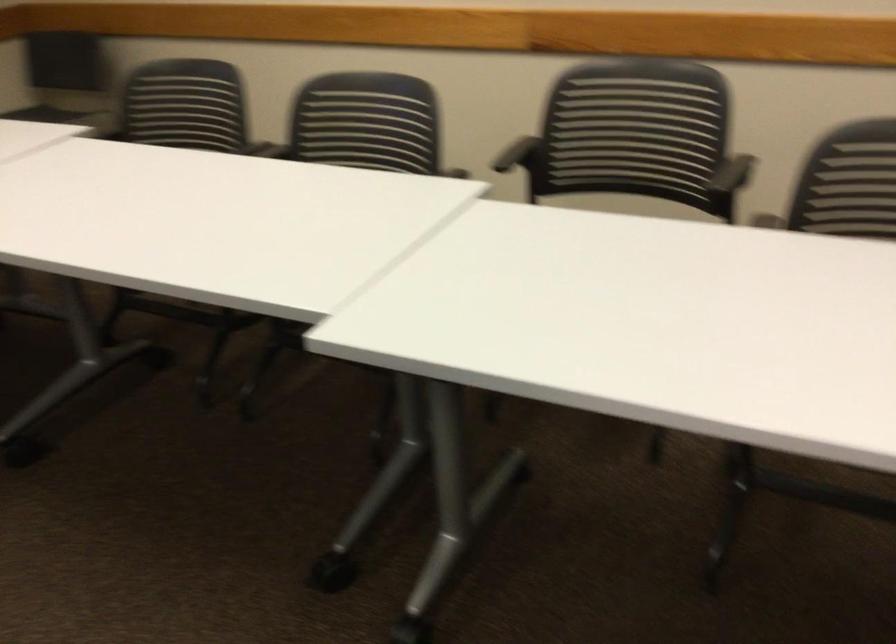
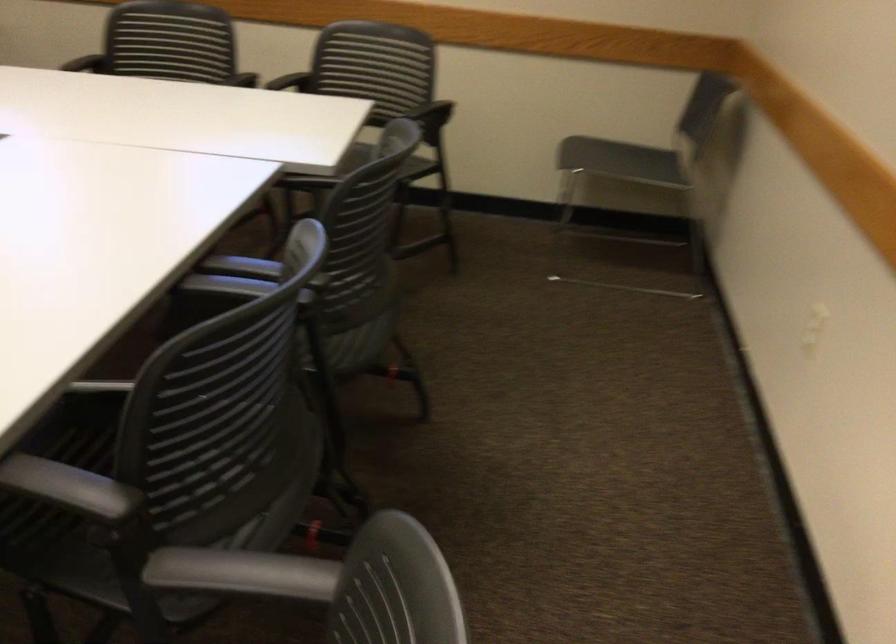
In the second image, find the point that corresponds to pixel 442 185 in the first image.

(71, 488)